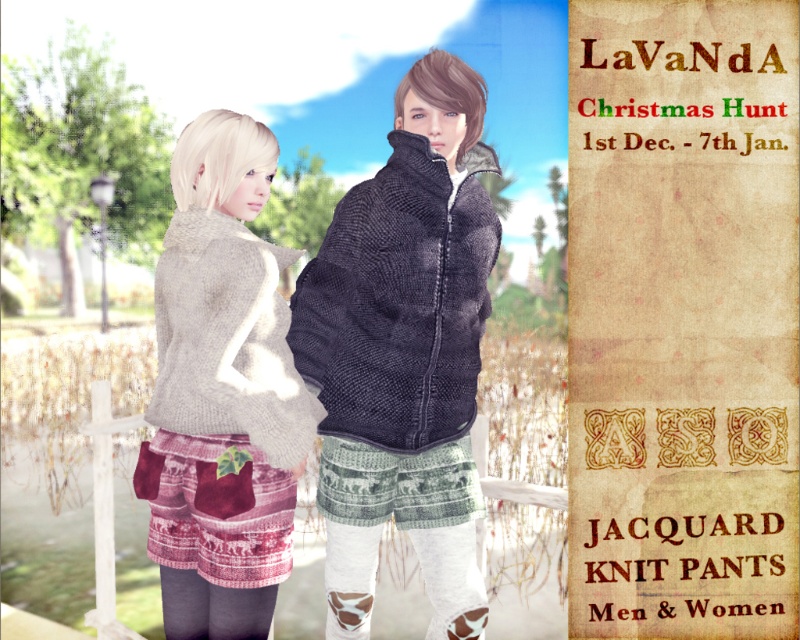
Can you confirm if jacquard knit pants at right is wider than knitted gray sweater at center?

Yes.

Between jacquard knit pants at right and knitted gray sweater at center, which one has less height?

Standing shorter between the two is knitted gray sweater at center.

Is point (770, 394) positioned before point (162, 340)?

No, (770, 394) is behind (162, 340).

This screenshot has width=800, height=640. I want to click on jacquard knit pants at right, so click(684, 317).

Is the position of jacquard knit pants at right less distant than that of knitted wool sweater at center?

No, it is behind knitted wool sweater at center.

In the scene shown: Who is shorter, jacquard knit pants at right or knitted wool sweater at center?

With less height is knitted wool sweater at center.

Which is in front, point (736, 216) or point (237, 497)?

Point (237, 497)

The image size is (800, 640). I want to click on jacquard knit pants at right, so click(684, 317).

Who is positioned more to the right, knitted wool sweater at center or dark gray knitted jacket at center?

dark gray knitted jacket at center is more to the right.

Who is more distant from viewer, (x=258, y=545) or (x=288, y=346)?

The point (x=288, y=346) is behind.

Locate an element on the screen. The width and height of the screenshot is (800, 640). knitted wool sweater at center is located at coordinates (222, 392).

Find the location of a particular element. This screenshot has height=640, width=800. knitted wool sweater at center is located at coordinates click(x=222, y=392).